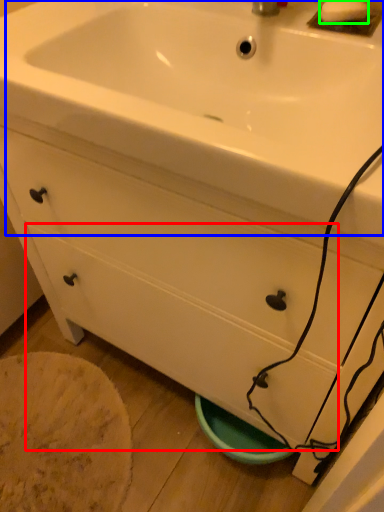
Question: Which object is the closest to the drawer (highlighted by a red box)? Choose among these: sink (highlighted by a blue box) or soap (highlighted by a green box).

Choices:
 (A) sink
 (B) soap

Answer: (A)